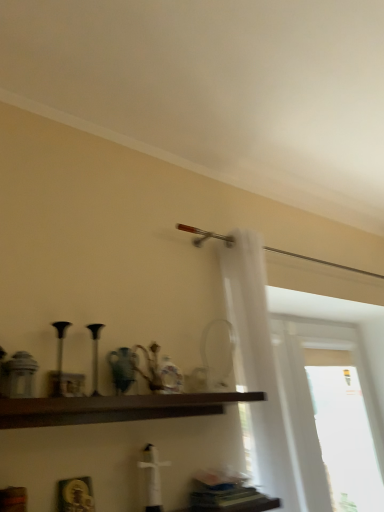
Question: Is white sheer curtain at right at the left side of transparent glass window at right?

Choices:
 (A) yes
 (B) no

Answer: (A)

Question: From a real-world perspective, is white sheer curtain at right below transparent glass window at right?

Choices:
 (A) no
 (B) yes

Answer: (A)

Question: Does white sheer curtain at right lie in front of transparent glass window at right?

Choices:
 (A) yes
 (B) no

Answer: (A)

Question: Considering the relative sizes of white sheer curtain at right and transparent glass window at right in the image provided, is white sheer curtain at right taller than transparent glass window at right?

Choices:
 (A) yes
 (B) no

Answer: (B)

Question: From the image's perspective, does white sheer curtain at right appear lower than transparent glass window at right?

Choices:
 (A) yes
 (B) no

Answer: (B)

Question: Does white sheer curtain at right have a lesser height compared to transparent glass window at right?

Choices:
 (A) no
 (B) yes

Answer: (B)

Question: Is transparent glass window at right next to white sheer curtain at right and touching it?

Choices:
 (A) yes
 (B) no

Answer: (B)

Question: From a real-world perspective, is transparent glass window at right under white sheer curtain at right?

Choices:
 (A) no
 (B) yes

Answer: (B)

Question: Considering the relative sizes of transparent glass window at right and white sheer curtain at right in the image provided, is transparent glass window at right thinner than white sheer curtain at right?

Choices:
 (A) yes
 (B) no

Answer: (A)

Question: Is transparent glass window at right to the right of white sheer curtain at right from the viewer's perspective?

Choices:
 (A) no
 (B) yes

Answer: (B)

Question: Considering the relative positions of transparent glass window at right and white sheer curtain at right in the image provided, is transparent glass window at right in front of white sheer curtain at right?

Choices:
 (A) yes
 (B) no

Answer: (B)

Question: Does transparent glass window at right have a greater width compared to white sheer curtain at right?

Choices:
 (A) no
 (B) yes

Answer: (A)

Question: Is transparent glass window at right bigger than dark brown wood shelf at center?

Choices:
 (A) yes
 (B) no

Answer: (A)